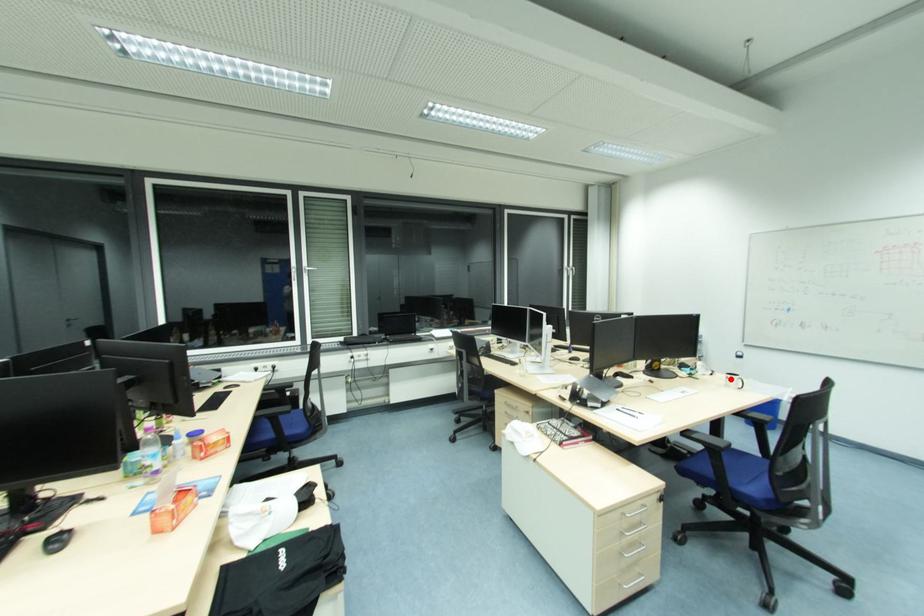
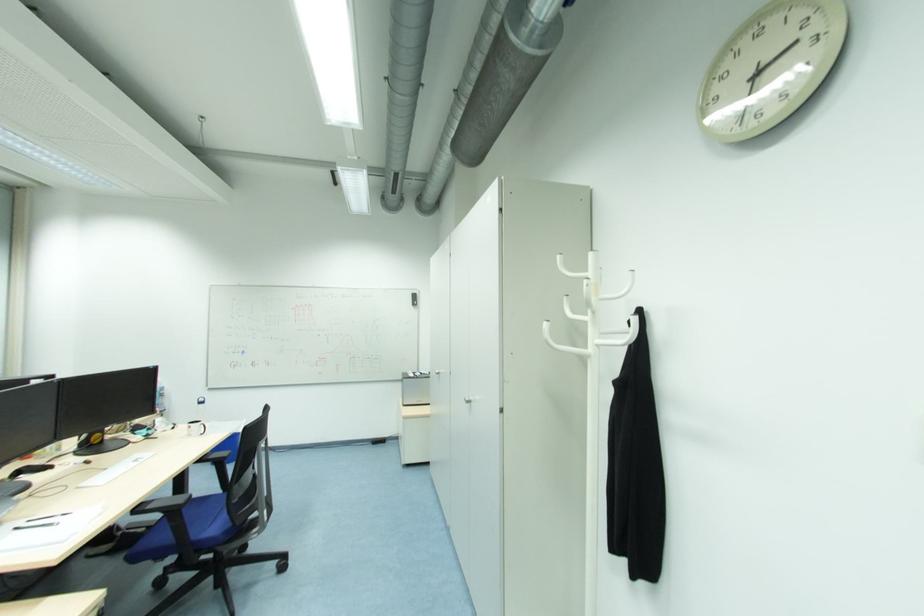
Question: I am providing you with two images of the same scene from different viewpoints. In image1, a red point is highlighted. Considering the same 3D point in image2, which of the following is correct?

Choices:
 (A) It is closer
 (B) It is farther

Answer: (B)